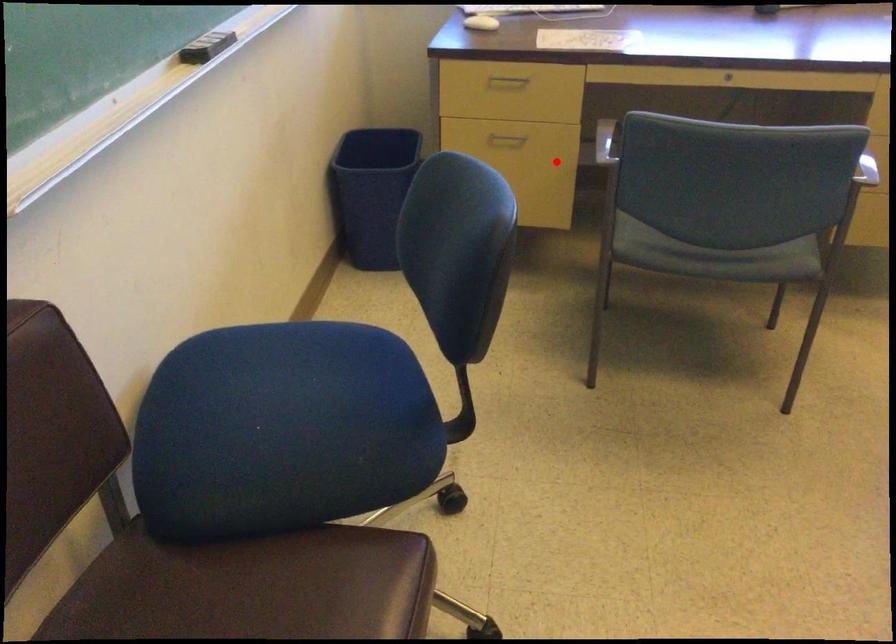
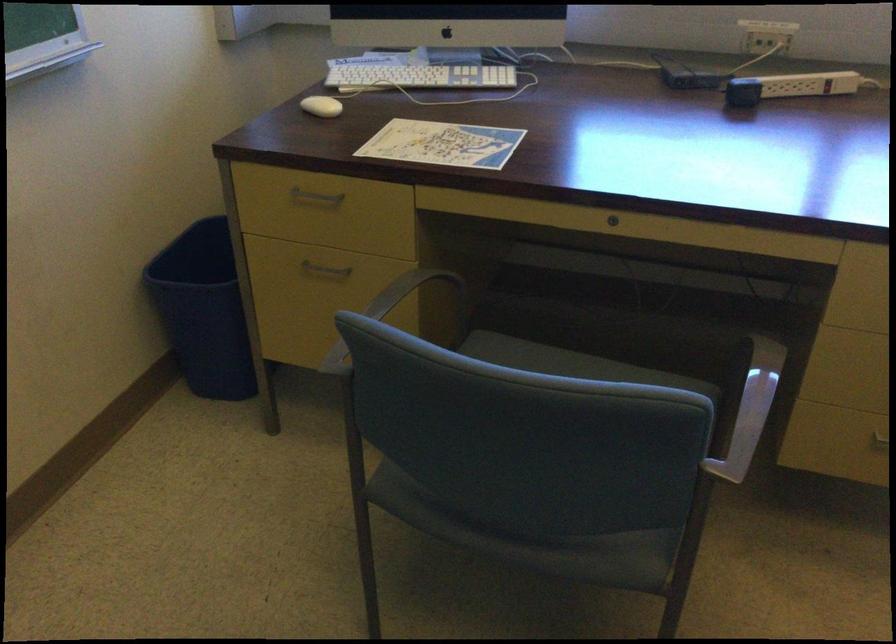
Locate, in the second image, the point that corresponds to the highlighted location in the first image.

(393, 308)